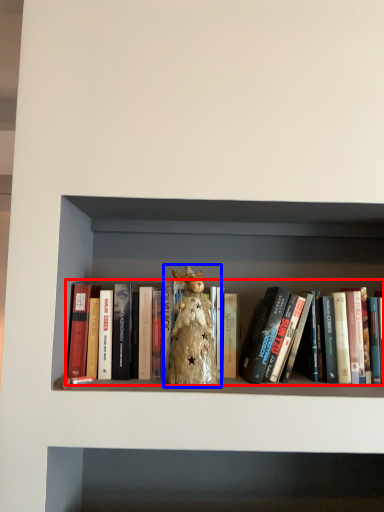
Question: Which object appears farthest to the camera in this image, book (highlighted by a red box) or toy (highlighted by a blue box)?

Choices:
 (A) book
 (B) toy

Answer: (A)